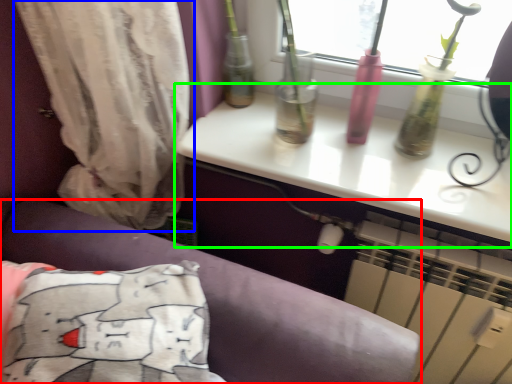
Question: Which object is positioned farthest from furniture (highlighted by a red box)? Select from curtain (highlighted by a blue box) and table (highlighted by a green box).

Choices:
 (A) curtain
 (B) table

Answer: (B)